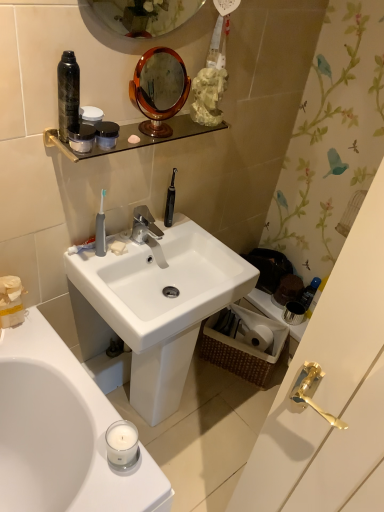
Question: Visually, is white matte toilet paper at lower right positioned to the left or to the right of clear glass shelf at upper center?

Choices:
 (A) right
 (B) left

Answer: (A)

Question: In terms of size, does white matte toilet paper at lower right appear bigger or smaller than clear glass shelf at upper center?

Choices:
 (A) big
 (B) small

Answer: (A)

Question: Which object is the farthest from the blue glossy bottle at right, the 3th mouthwash positioned from the front?

Choices:
 (A) metallic silver cup at right
 (B) white matte toilet paper at lower right
 (C) silver metallic faucet at center
 (D) black matte spray can at upper left
 (E) white glossy sink at center

Answer: (D)

Question: Which object is positioned farthest from the matte black jar at upper center, marked as the 2th mouthwash in a right-to-left arrangement?

Choices:
 (A) white matte toilet paper at lower right
 (B) matte black jar at upper center, which appears as the second mouthwash when viewed from the top
 (C) white glossy sink at center
 (D) woven brown picnic basket at lower right
 (E) shiny brown mirror at upper center

Answer: (E)